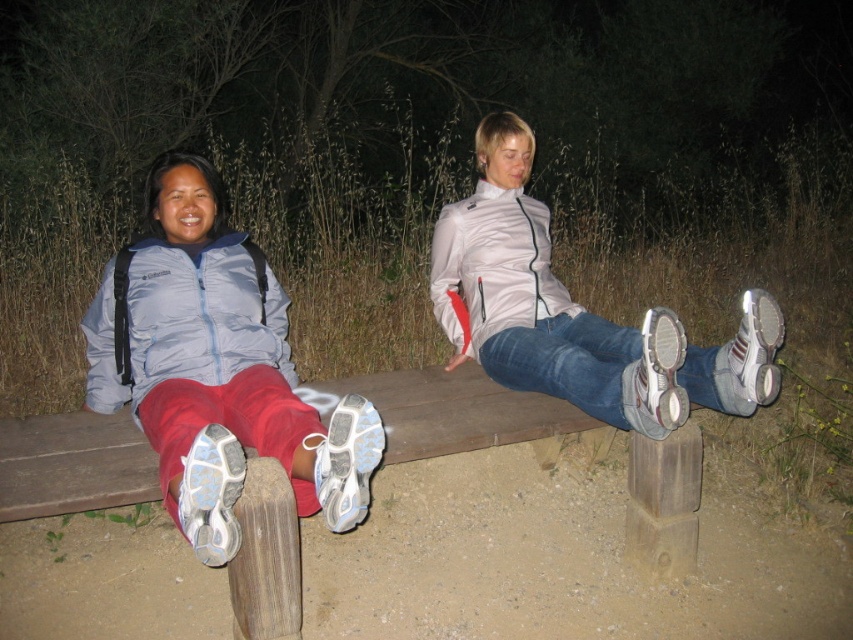
Question: From the image, what is the correct spatial relationship of matte blue jacket at left in relation to white matte sneakers at center?

Choices:
 (A) above
 (B) below

Answer: (B)

Question: Is matte blue jacket at left further to camera compared to white matte sneakers at center?

Choices:
 (A) no
 (B) yes

Answer: (A)

Question: Does matte blue jacket at left come behind white matte sneakers at center?

Choices:
 (A) no
 (B) yes

Answer: (A)

Question: Which point appears closest to the camera in this image?

Choices:
 (A) (320, 483)
 (B) (515, 122)

Answer: (A)

Question: Which object appears closest to the camera in this image?

Choices:
 (A) white matte sneakers at center
 (B) matte blue jacket at left

Answer: (B)